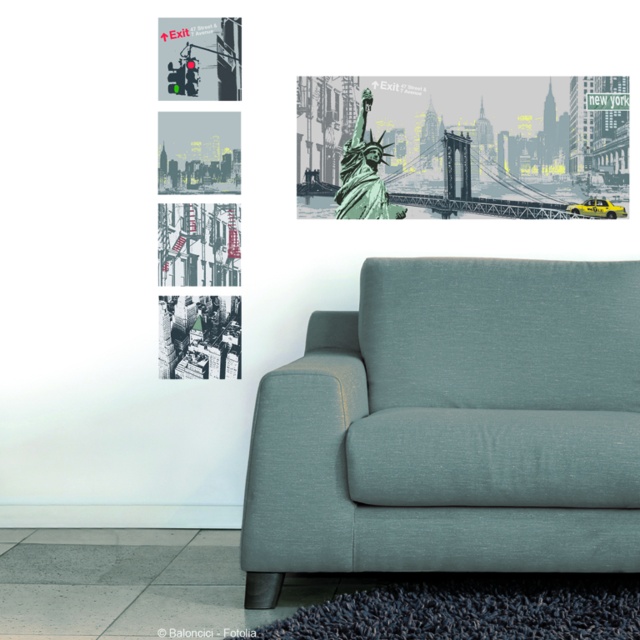
Does point (189, 188) come farther from viewer compared to point (349, 150)?

No, it is in front of (349, 150).

Find the location of a particular element. This screenshot has height=640, width=640. gray matte cityscape at upper left is located at coordinates (198, 152).

Which of these two, matte gray fabric couch at center or green matte statue at upper center, stands shorter?

green matte statue at upper center

Is the position of matte gray fabric couch at center less distant than that of green matte statue at upper center?

Yes, it is in front of green matte statue at upper center.

Between point (314, 428) and point (353, 211), which one is positioned in front?

Point (314, 428) is in front.

Where is `matte gray fabric couch at center`? matte gray fabric couch at center is located at coordinates (452, 426).

Is green statue at upper center above metallic traffic light at upper left?

Incorrect, green statue at upper center is not positioned above metallic traffic light at upper left.

Does point (374, 208) come closer to viewer compared to point (160, 97)?

No, it is not.

Between point (625, 205) and point (163, 81), which one is positioned behind?

The point (625, 205) is behind.

This screenshot has width=640, height=640. Find the location of `green statue at upper center`. green statue at upper center is located at coordinates (464, 145).